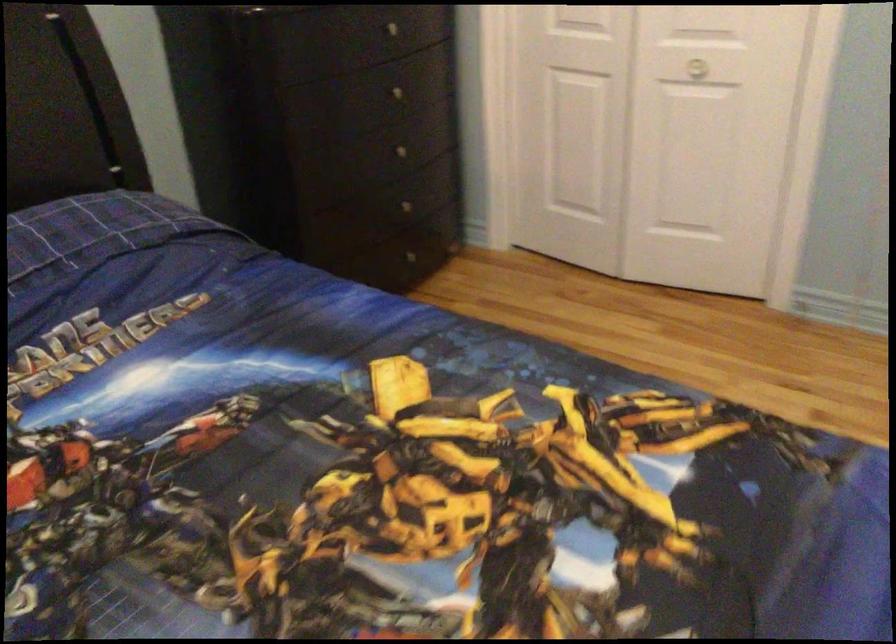
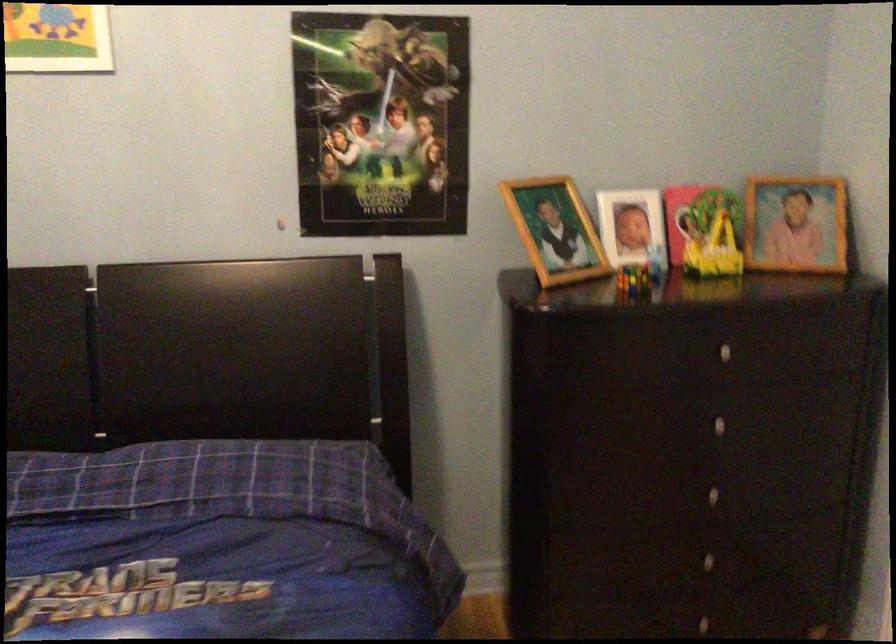
In the second image, find the point that corresponds to the point at 403,172 in the first image.

(711, 516)